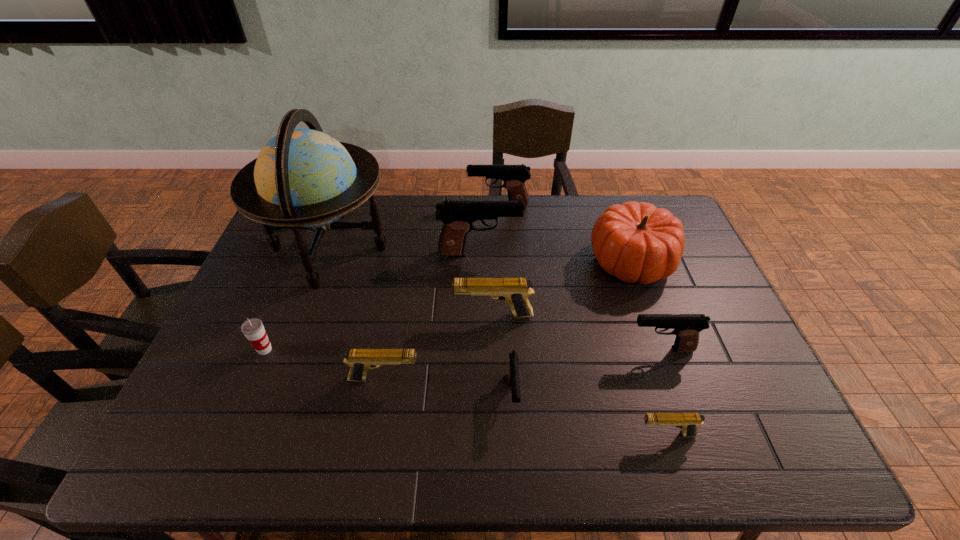
Identify which pistol is the fifth closest to the farthest object. Please provide its 2D coordinates. Your answer should be formatted as a tuple, i.e. [(x, y)], where the tuple contains the x and y coordinates of a point satisfying the conditions above.

[(360, 361)]

The width and height of the screenshot is (960, 540). What are the coordinates of `pistol that can be found as the fourth closest to the rightmost black pistol` in the screenshot? It's located at (457, 216).

You are a GUI agent. You are given a task and a screenshot of the screen. Output one action in this format:
    pyautogui.click(x=<x>, y=<y>)
    Task: Click on the second closest black pistol to the globe
    
    Given the screenshot: What is the action you would take?
    pyautogui.click(x=514, y=176)

Identify the location of black pistol object that ranks as the fourth closest to the leftmost pistol. (514, 176).

Locate which tan pistol is the closest to the fourth nearest pistol. Please provide its 2D coordinates. Your answer should be formatted as a tuple, i.e. [(x, y)], where the tuple contains the x and y coordinates of a point satisfying the conditions above.

[(688, 422)]

Find the location of `tan pistol that is the second closest to the farthest object`. tan pistol that is the second closest to the farthest object is located at coordinates point(360,361).

This screenshot has width=960, height=540. I want to click on vacant space that satisfies the following two spatial constraints: 1. on the surface of the globe; 2. on the back side of the pumpkin, so click(324, 261).

Image resolution: width=960 pixels, height=540 pixels. In order to click on free point that satisfies the following two spatial constraints: 1. at the barrel of the second farthest pistol; 2. on the back side of the pumpkin in this screenshot , I will do `click(480, 261)`.

At what (x,y) coordinates should I click in order to perform the action: click on vacant space that satisfies the following two spatial constraints: 1. at the barrel of the biggest black pistol; 2. on the left side of the pumpkin. Please return your answer as a coordinate pair (x, y). The image size is (960, 540). Looking at the image, I should click on (480, 261).

The image size is (960, 540). Find the location of `free location that satisfies the following two spatial constraints: 1. on the surface of the tallest object; 2. on the left side of the pumpkin`. free location that satisfies the following two spatial constraints: 1. on the surface of the tallest object; 2. on the left side of the pumpkin is located at coordinates (324, 261).